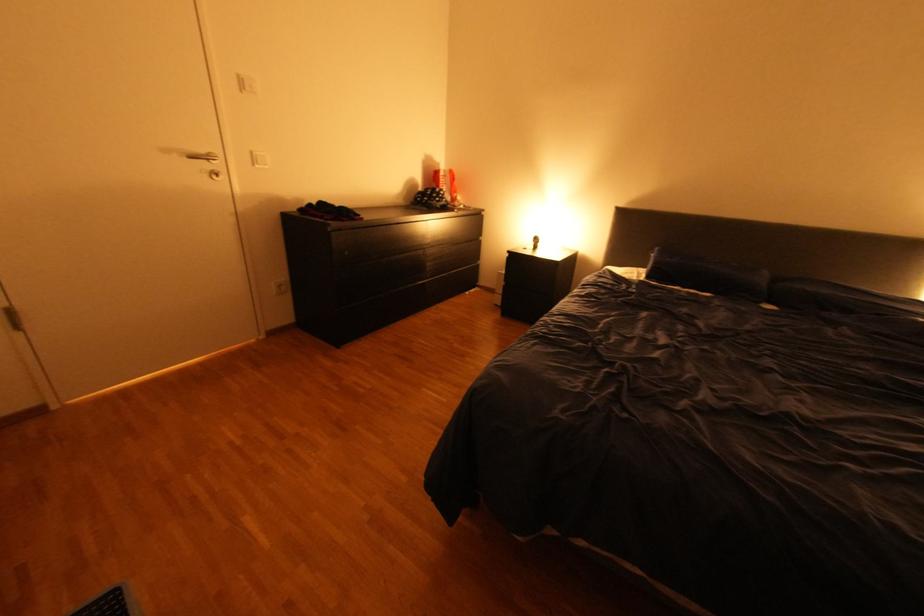
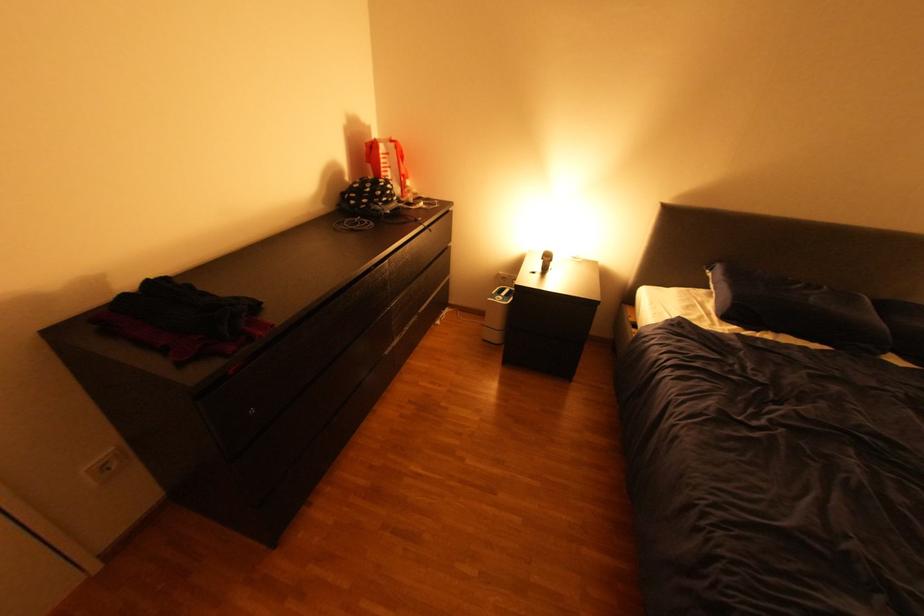
Find the pixel in the second image that matches pixel 289 286 in the first image.

(114, 467)